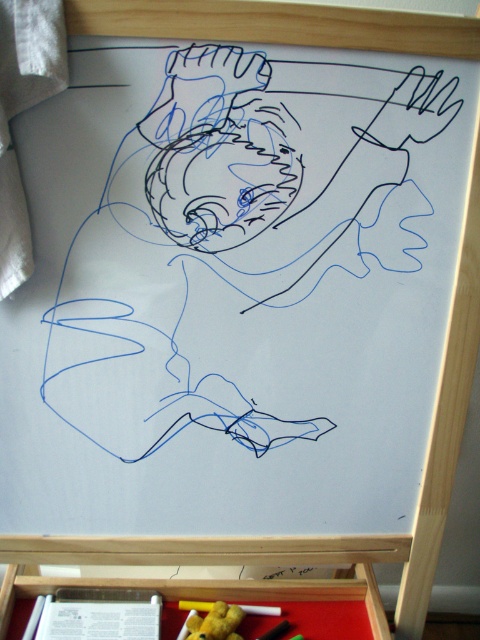
Question: Among these points, which one is nearest to the camera?

Choices:
 (A) (374, 612)
 (B) (210, 604)

Answer: (A)

Question: Considering the relative positions of red matte drawer at lower center and yellow matte crayon at lower center in the image provided, where is red matte drawer at lower center located with respect to yellow matte crayon at lower center?

Choices:
 (A) above
 (B) below

Answer: (A)

Question: Is red matte drawer at lower center bigger than yellow matte crayon at lower center?

Choices:
 (A) no
 (B) yes

Answer: (B)

Question: Can you confirm if red matte drawer at lower center is smaller than yellow matte crayon at lower center?

Choices:
 (A) no
 (B) yes

Answer: (A)

Question: Which point is closer to the camera?

Choices:
 (A) red matte drawer at lower center
 (B) yellow matte crayon at lower center

Answer: (A)